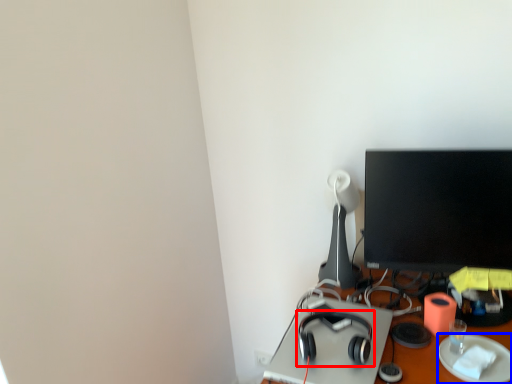
Question: Which object appears farthest to the camera in this image, headphones (highlighted by a red box) or paper plate (highlighted by a blue box)?

Choices:
 (A) headphones
 (B) paper plate

Answer: (A)